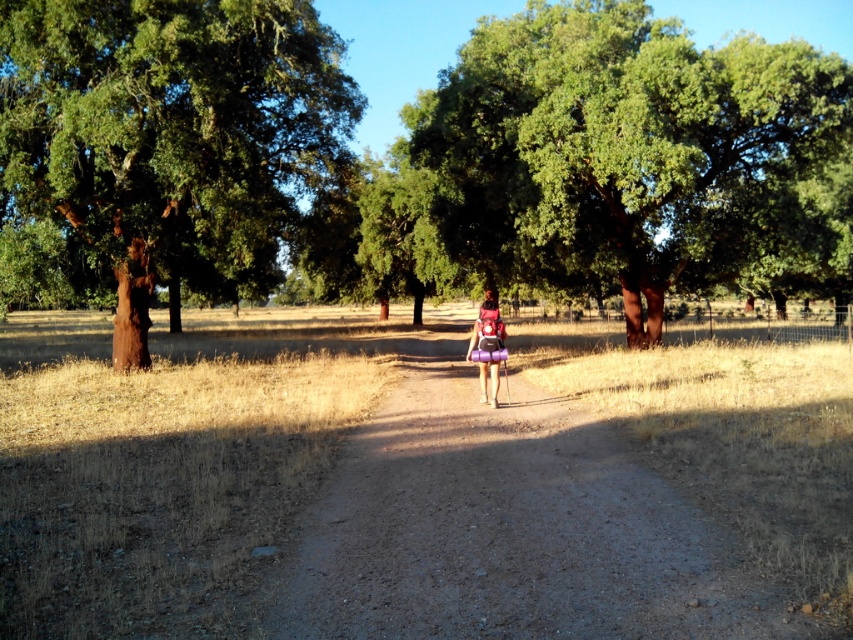
Which is above, dirt path at center or brown bark tree at left?

Positioned higher is brown bark tree at left.

Can you confirm if dirt path at center is smaller than brown bark tree at left?

Indeed, dirt path at center has a smaller size compared to brown bark tree at left.

Find the location of a particular element. The height and width of the screenshot is (640, 853). dirt path at center is located at coordinates (508, 528).

This screenshot has width=853, height=640. In order to click on dirt path at center in this screenshot , I will do `click(508, 528)`.

What do you see at coordinates (508, 528) in the screenshot? I see `dirt path at center` at bounding box center [508, 528].

Who is more distant from viewer, (724, 564) or (495, 378)?

The point (495, 378) is behind.

Where is `dirt path at center`? The width and height of the screenshot is (853, 640). dirt path at center is located at coordinates (508, 528).

Who is higher up, green leafy tree at center or brown bark tree at left?

green leafy tree at center

Is green leafy tree at center above brown bark tree at left?

Yes.

Between point (753, 100) and point (247, 269), which one is positioned in front?

Point (753, 100)

At what (x,y) coordinates should I click in order to perform the action: click on green leafy tree at center. Please return your answer as a coordinate pair (x, y). The height and width of the screenshot is (640, 853). Looking at the image, I should click on (625, 154).